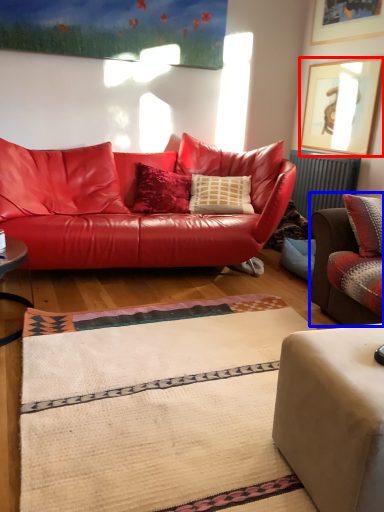
Question: Which point is closer to the camera, picture frame (highlighted by a red box) or studio couch (highlighted by a blue box)?

Choices:
 (A) picture frame
 (B) studio couch

Answer: (B)